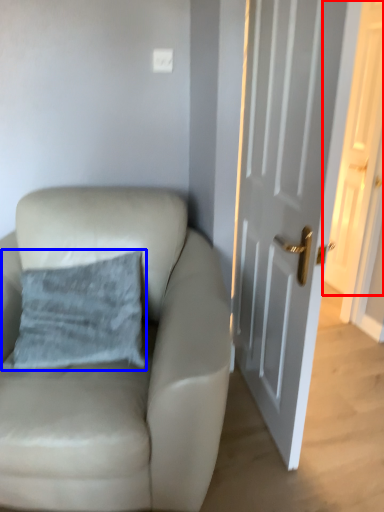
Question: Which point is further to the camera, door (highlighted by a red box) or pillow (highlighted by a blue box)?

Choices:
 (A) door
 (B) pillow

Answer: (A)